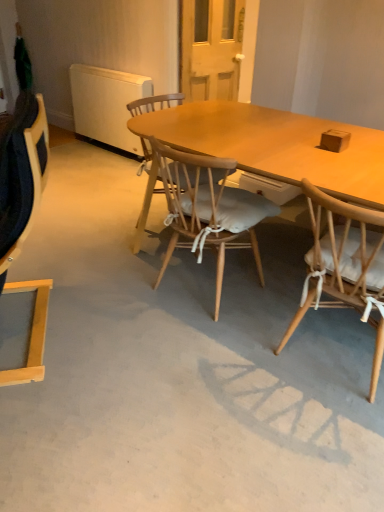
Measure the distance between point (339, 130) and camera.

Point (339, 130) is 2.17 meters away from camera.

This screenshot has height=512, width=384. What do you see at coordinates (208, 209) in the screenshot?
I see `wooden chair with cushion at center, acting as the second chair starting from the right` at bounding box center [208, 209].

Identify the location of white matte radiator at upper left. The image size is (384, 512). (106, 104).

Choose the correct answer: Is white matte radiator at upper left inside wooden chair with cushion at center, acting as the second chair starting from the right, or outside it?

The correct answer is: outside.

Is white matte radiator at upper left looking in the opposite direction of wooden chair with cushion at center, arranged as the second chair when viewed from the left?

No, white matte radiator at upper left is not facing the opposite direction of wooden chair with cushion at center, arranged as the second chair when viewed from the left.

Which is behind, white matte radiator at upper left or wooden chair with cushion at center, acting as the second chair starting from the right?

white matte radiator at upper left is behind.

From a real-world perspective, is white matte radiator at upper left physically above wooden chair with cushion at center, acting as the second chair starting from the right?

No, from a real-world perspective, white matte radiator at upper left is not on top of wooden chair with cushion at center, acting as the second chair starting from the right.

From the image's perspective, between wooden chair with cushion at center, acting as the second chair starting from the right, and wooden chair with white cushion at right, placed as the 1th chair when sorted from right to left, which one is located above?

wooden chair with cushion at center, acting as the second chair starting from the right.

Can you tell me how much wooden chair with cushion at center, acting as the second chair starting from the right, and wooden chair with white cushion at right, the 3th chair from the left, differ in facing direction?

The facing directions of wooden chair with cushion at center, acting as the second chair starting from the right, and wooden chair with white cushion at right, the 3th chair from the left, are 4.4e-05 degrees apart.

Can wooden chair with white cushion at right, the 3th chair from the left, be found inside wooden chair with cushion at center, arranged as the second chair when viewed from the left?

No, wooden chair with white cushion at right, the 3th chair from the left, is not inside wooden chair with cushion at center, arranged as the second chair when viewed from the left.

Between wooden chair with cushion at center, arranged as the second chair when viewed from the left, and wooden chair with white cushion at right, placed as the 1th chair when sorted from right to left, which one has smaller size?

Smaller between the two is wooden chair with cushion at center, arranged as the second chair when viewed from the left.

Find the location of a particular element. The height and width of the screenshot is (512, 384). the 2nd chair behind the light wood chair at left, placed as the first chair when sorted from left to right is located at coordinates (208, 209).

How many degrees apart are the facing directions of light wood chair at left, marked as the third chair in a right-to-left arrangement, and wooden chair with cushion at center, acting as the second chair starting from the right?

The angle between the facing direction of light wood chair at left, marked as the third chair in a right-to-left arrangement, and the facing direction of wooden chair with cushion at center, acting as the second chair starting from the right, is 144 degrees.

Considering their positions, is light wood chair at left, placed as the first chair when sorted from left to right, located in front of or behind wooden chair with cushion at center, arranged as the second chair when viewed from the left?

Clearly, light wood chair at left, placed as the first chair when sorted from left to right, is in front of wooden chair with cushion at center, arranged as the second chair when viewed from the left.

Considering the relative sizes of light wood chair at left, marked as the third chair in a right-to-left arrangement, and wooden chair with cushion at center, acting as the second chair starting from the right, in the image provided, is light wood chair at left, marked as the third chair in a right-to-left arrangement, smaller than wooden chair with cushion at center, acting as the second chair starting from the right,?

No.

Is wooden chair with white cushion at right, placed as the 1th chair when sorted from right to left, wider than light wood chair at left, marked as the third chair in a right-to-left arrangement?

Indeed, wooden chair with white cushion at right, placed as the 1th chair when sorted from right to left, has a greater width compared to light wood chair at left, marked as the third chair in a right-to-left arrangement.

Based on the photo, what's the angular difference between wooden chair with white cushion at right, the 3th chair from the left, and light wood chair at left, placed as the first chair when sorted from left to right,'s facing directions?

wooden chair with white cushion at right, the 3th chair from the left, and light wood chair at left, placed as the first chair when sorted from left to right, are facing 144 degrees away from each other.

Consider the image. Which is correct: wooden chair with white cushion at right, placed as the 1th chair when sorted from right to left, is inside light wood chair at left, placed as the first chair when sorted from left to right, or outside of it?

The correct answer is: outside.

Is wooden chair with white cushion at right, placed as the 1th chair when sorted from right to left, positioned with its back to light wood chair at left, placed as the first chair when sorted from left to right?

That's not correct — wooden chair with white cushion at right, placed as the 1th chair when sorted from right to left, is not looking away from light wood chair at left, placed as the first chair when sorted from left to right.

Is wooden chair with white cushion at right, placed as the 1th chair when sorted from right to left, completely or partially outside of white matte radiator at upper left?

That's correct, wooden chair with white cushion at right, placed as the 1th chair when sorted from right to left, is outside of white matte radiator at upper left.

Considering the sizes of wooden chair with white cushion at right, placed as the 1th chair when sorted from right to left, and white matte radiator at upper left in the image, is wooden chair with white cushion at right, placed as the 1th chair when sorted from right to left, taller or shorter than white matte radiator at upper left?

In the image, wooden chair with white cushion at right, placed as the 1th chair when sorted from right to left, appears to be taller than white matte radiator at upper left.

Based on the photo, which object is positioned more to the left, wooden chair with white cushion at right, the 3th chair from the left, or white matte radiator at upper left?

Positioned to the left is white matte radiator at upper left.

Which is correct: white matte radiator at upper left is inside wooden chair with white cushion at right, placed as the 1th chair when sorted from right to left, or outside of it?

white matte radiator at upper left is spatially situated outside wooden chair with white cushion at right, placed as the 1th chair when sorted from right to left.

At what (x,y) coordinates should I click in order to perform the action: click on the 2nd chair in front of the white matte radiator at upper left, counting from the anchor's position. Please return your answer as a coordinate pair (x, y). Looking at the image, I should click on (345, 267).

Is white matte radiator at upper left not close to wooden chair with white cushion at right, placed as the 1th chair when sorted from right to left?

Yes, white matte radiator at upper left and wooden chair with white cushion at right, placed as the 1th chair when sorted from right to left, are quite far apart.

In the scene shown: Which object is thinner, brown matte box at upper right or wooden chair with white cushion at right, the 3th chair from the left?

With smaller width is brown matte box at upper right.

Find the location of `box above the wooden chair with white cushion at right, the 3th chair from the left (from a real-world perspective)`. box above the wooden chair with white cushion at right, the 3th chair from the left (from a real-world perspective) is located at coordinates (x=335, y=140).

From the image's perspective, is brown matte box at upper right over wooden chair with white cushion at right, the 3th chair from the left?

Yes, from the image's perspective, brown matte box at upper right is on top of wooden chair with white cushion at right, the 3th chair from the left.

Between brown matte box at upper right and wooden chair with white cushion at right, placed as the 1th chair when sorted from right to left, which one appears on the left side from the viewer's perspective?

brown matte box at upper right.

You are a GUI agent. You are given a task and a screenshot of the screen. Output one action in this format:
    pyautogui.click(x=<x>, y=<y>)
    Task: Click on the radiator below the wooden chair with cushion at center, acting as the second chair starting from the right (from a real-world perspective)
    The height and width of the screenshot is (512, 384).
    Given the screenshot: What is the action you would take?
    pyautogui.click(x=106, y=104)

The width and height of the screenshot is (384, 512). Identify the location of chair behind the wooden chair with white cushion at right, the 3th chair from the left. (208, 209).

Looking at the image, which one is located closer to wooden chair with cushion at center, acting as the second chair starting from the right, light wood chair at left, marked as the third chair in a right-to-left arrangement, or brown matte box at upper right?

brown matte box at upper right.

When comparing their distances from brown matte box at upper right, does wooden chair with white cushion at right, the 3th chair from the left, or light wood chair at left, placed as the first chair when sorted from left to right, seem closer?

The object closer to brown matte box at upper right is wooden chair with white cushion at right, the 3th chair from the left.

Looking at the image, which one is located closer to light wood chair at left, placed as the first chair when sorted from left to right, wooden chair with white cushion at right, placed as the 1th chair when sorted from right to left, or brown matte box at upper right?

The object closer to light wood chair at left, placed as the first chair when sorted from left to right, is wooden chair with white cushion at right, placed as the 1th chair when sorted from right to left.

Which object lies further to the anchor point brown matte box at upper right, light wood chair at left, placed as the first chair when sorted from left to right, or wooden chair with cushion at center, acting as the second chair starting from the right?

Among the two, light wood chair at left, placed as the first chair when sorted from left to right, is located further to brown matte box at upper right.

Which object lies nearer to the anchor point brown matte box at upper right, light wood chair at left, placed as the first chair when sorted from left to right, or wooden chair with white cushion at right, the 3th chair from the left?

The object closer to brown matte box at upper right is wooden chair with white cushion at right, the 3th chair from the left.

Which object lies further to the anchor point wooden chair with white cushion at right, the 3th chair from the left, light wood chair at left, marked as the third chair in a right-to-left arrangement, or white matte radiator at upper left?

white matte radiator at upper left lies further to wooden chair with white cushion at right, the 3th chair from the left, than the other object.

Based on their spatial positions, is white matte radiator at upper left or brown matte box at upper right closer to wooden chair with cushion at center, arranged as the second chair when viewed from the left?

Among the two, brown matte box at upper right is located nearer to wooden chair with cushion at center, arranged as the second chair when viewed from the left.

Considering their positions, is wooden chair with cushion at center, arranged as the second chair when viewed from the left, positioned further to light wood chair at left, marked as the third chair in a right-to-left arrangement, than white matte radiator at upper left?

white matte radiator at upper left lies further to light wood chair at left, marked as the third chair in a right-to-left arrangement, than the other object.

Locate an element on the screen. This screenshot has width=384, height=512. chair between wooden chair with white cushion at right, placed as the 1th chair when sorted from right to left, and brown matte box at upper right, along the z-axis is located at coordinates (208, 209).

Where is `box between light wood chair at left, placed as the first chair when sorted from left to right, and white matte radiator at upper left in the front-back direction`? This screenshot has height=512, width=384. box between light wood chair at left, placed as the first chair when sorted from left to right, and white matte radiator at upper left in the front-back direction is located at coordinates (335, 140).

You are a GUI agent. You are given a task and a screenshot of the screen. Output one action in this format:
    pyautogui.click(x=<x>, y=<y>)
    Task: Click on the box between light wood chair at left, placed as the first chair when sorted from left to right, and wooden chair with white cushion at right, placed as the 1th chair when sorted from right to left, in the horizontal direction
    This screenshot has width=384, height=512.
    Given the screenshot: What is the action you would take?
    pyautogui.click(x=335, y=140)

Identify the location of chair positioned between wooden chair with white cushion at right, the 3th chair from the left, and white matte radiator at upper left from near to far. (208, 209).